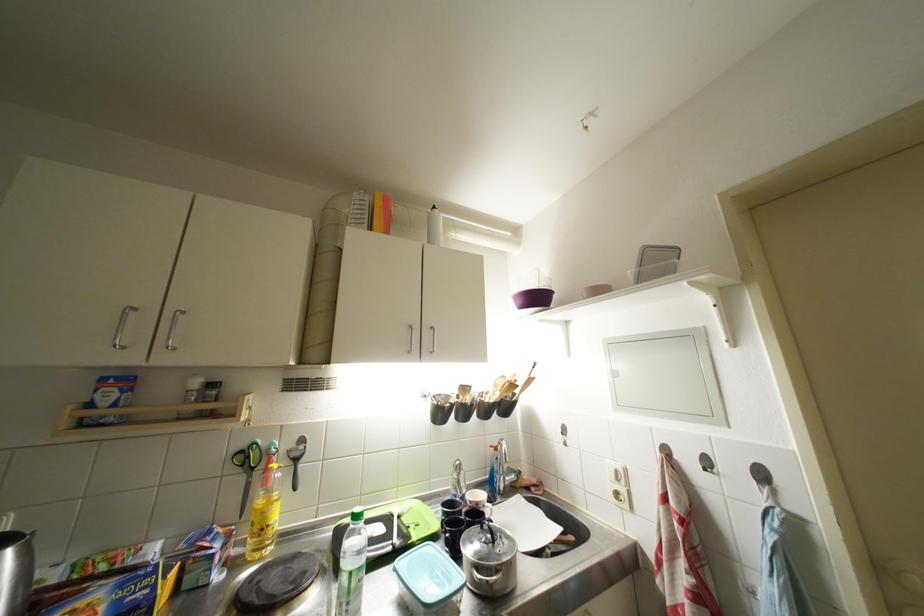
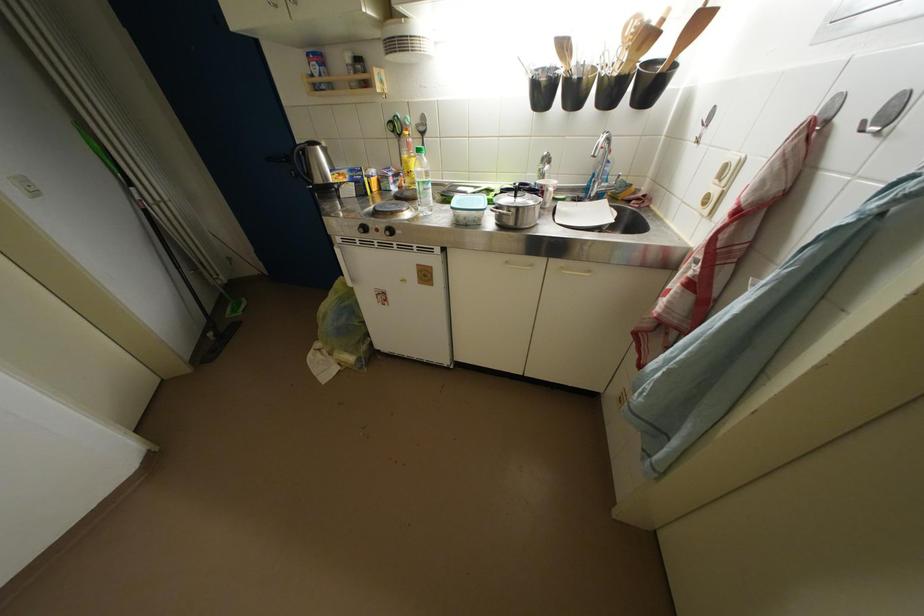
Locate, in the second image, the point that corresponds to point (260, 472) in the first image.

(407, 140)